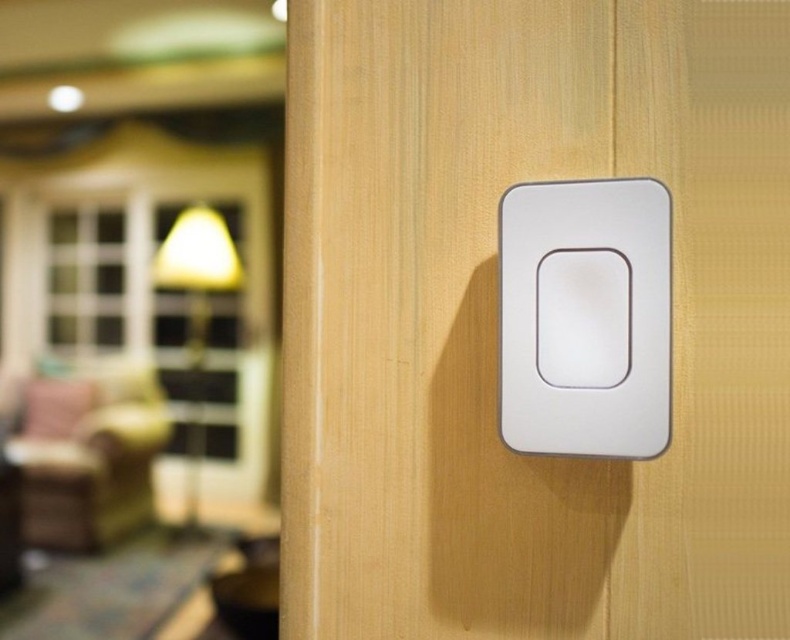
Question: Can you confirm if white matte switch at center is smaller than velvet pink armchair at left?

Choices:
 (A) no
 (B) yes

Answer: (A)

Question: Which point appears closest to the camera in this image?

Choices:
 (A) (87, 493)
 (B) (182, 243)

Answer: (B)

Question: Which point is farther to the camera?

Choices:
 (A) (570, 275)
 (B) (706, 12)
 (C) (156, 419)

Answer: (C)

Question: Is white matte switch at center below matte yellow lampshade at upper left?

Choices:
 (A) yes
 (B) no

Answer: (A)

Question: Can you confirm if white matte switch at center is smaller than matte yellow lampshade at left?

Choices:
 (A) yes
 (B) no

Answer: (B)

Question: Among these points, which one is farthest from the camera?

Choices:
 (A) (661, 250)
 (B) (132, 506)

Answer: (B)